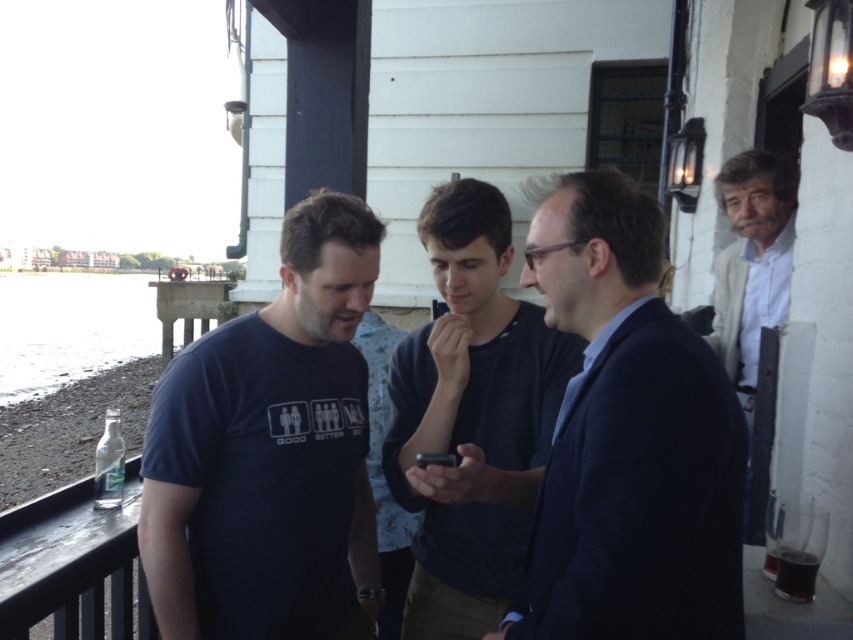
Question: Which point appears farthest from the camera in this image?

Choices:
 (A) (425, 408)
 (B) (787, 288)

Answer: (B)

Question: Which of these objects is positioned closest to the dark blue suit at center?

Choices:
 (A) dark blue shirt at center
 (B) white matte shirt at upper right

Answer: (A)

Question: Is dark blue t-shirt at center closer to the viewer compared to dark blue suit at center?

Choices:
 (A) no
 (B) yes

Answer: (A)

Question: Does dark blue t-shirt at center have a larger size compared to white matte shirt at upper right?

Choices:
 (A) no
 (B) yes

Answer: (A)

Question: Which is nearer to the white matte shirt at upper right?

Choices:
 (A) dark blue suit at center
 (B) dark blue shirt at center

Answer: (B)

Question: Can you confirm if dark blue suit at center is wider than dark blue shirt at center?

Choices:
 (A) yes
 (B) no

Answer: (B)